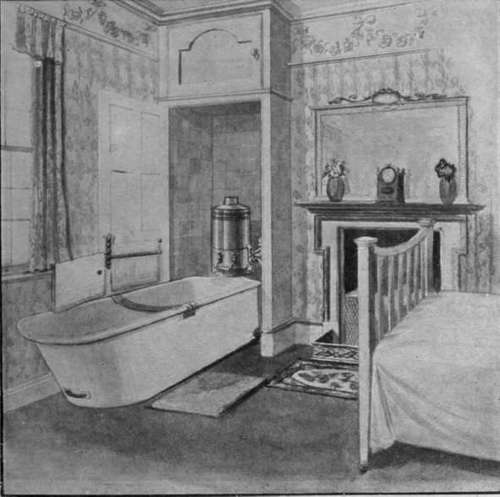
The image size is (500, 497). I want to click on bed, so click(425, 369).